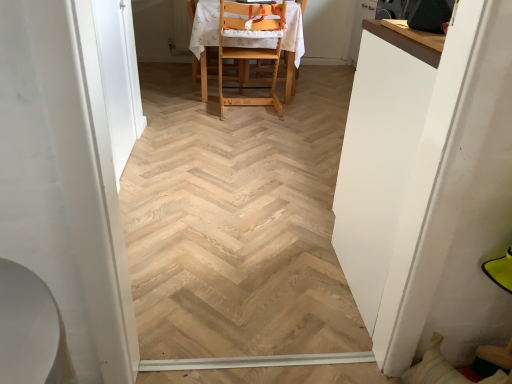
Locate an element on the screen. The height and width of the screenshot is (384, 512). vacant area that lies to the right of white glossy door at left, acting as the second screen door starting from the front is located at coordinates (200, 162).